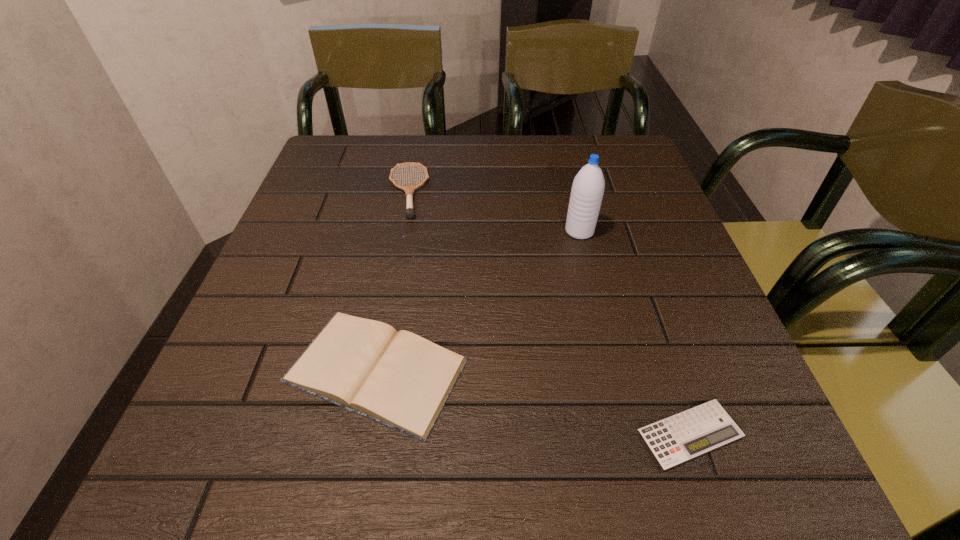
I want to click on vacant space at the far left corner, so click(332, 167).

You are a GUI agent. You are given a task and a screenshot of the screen. Output one action in this format:
    pyautogui.click(x=<x>, y=<y>)
    Task: Click on the free space between the farthest object and the shortest object
    The image size is (960, 540).
    Given the screenshot: What is the action you would take?
    pyautogui.click(x=549, y=313)

The image size is (960, 540). What are the coordinates of `empty location between the tallest object and the Bible` in the screenshot? It's located at (478, 301).

Locate an element on the screen. free space between the shortest object and the water bottle is located at coordinates (635, 333).

Locate an element on the screen. free space between the water bottle and the tennis racket is located at coordinates (493, 212).

The width and height of the screenshot is (960, 540). What are the coordinates of `free space between the Bible and the tennis racket` in the screenshot? It's located at (392, 281).

You are a GUI agent. You are given a task and a screenshot of the screen. Output one action in this format:
    pyautogui.click(x=<x>, y=<y>)
    Task: Click on the vacant space that's between the water bottle and the farthest object
    
    Given the screenshot: What is the action you would take?
    pyautogui.click(x=493, y=212)

The image size is (960, 540). I want to click on vacant area that lies between the farthest object and the shortest object, so click(x=549, y=313).

The image size is (960, 540). Identify the location of free point between the calculator and the Bible. (533, 402).

Find the location of a particular element. The image size is (960, 540). free space between the shortest object and the Bible is located at coordinates (533, 402).